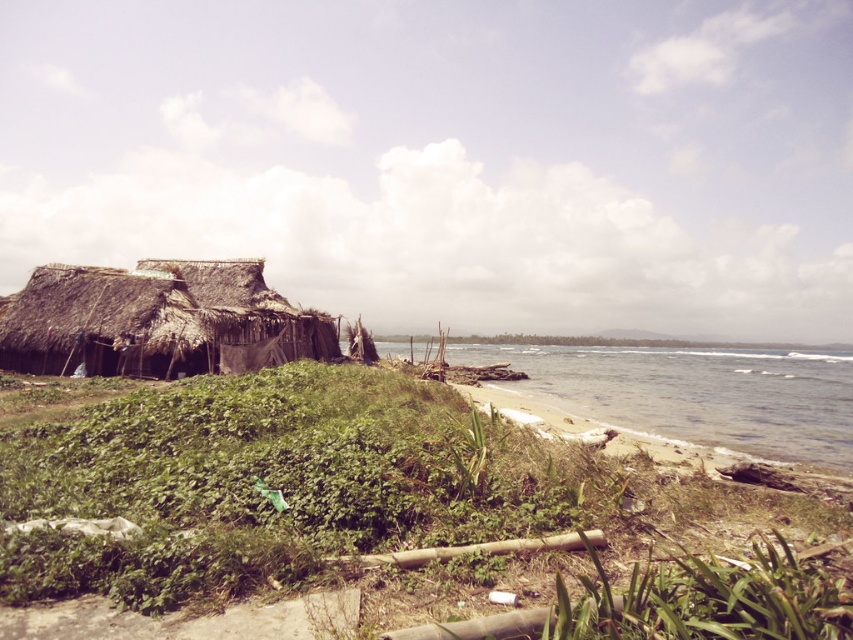
You are a GUI agent. You are given a task and a screenshot of the screen. Output one action in this format:
    pyautogui.click(x=<x>, y=<y>)
    Task: Click on the green grass at lower left
    The width and height of the screenshot is (853, 640).
    Given the screenshot: What is the action you would take?
    pyautogui.click(x=376, y=499)

Is green grass at lower left positioned before thatched straw hut at left?

Yes, it is in front of thatched straw hut at left.

Who is more forward, (334, 492) or (190, 266)?

Point (334, 492) is more forward.

The width and height of the screenshot is (853, 640). Identify the location of green grass at lower left. (376, 499).

Describe the element at coordinates (695, 396) in the screenshot. The image size is (853, 640). I see `clear water at lower right` at that location.

Does clear water at lower right lie behind thatched straw hut at left?

No.

Which is in front, point (607, 410) or point (33, 304)?

Point (607, 410)

I want to click on clear water at lower right, so click(x=695, y=396).

Which is in front, point (167, 385) or point (556, 371)?

Point (167, 385) is in front.

Does green grass at lower left have a lesser width compared to clear water at lower right?

Indeed, green grass at lower left has a lesser width compared to clear water at lower right.

Which is in front, point (241, 392) or point (624, 378)?

Point (241, 392)

This screenshot has height=640, width=853. Find the location of `green grass at lower left`. green grass at lower left is located at coordinates (376, 499).